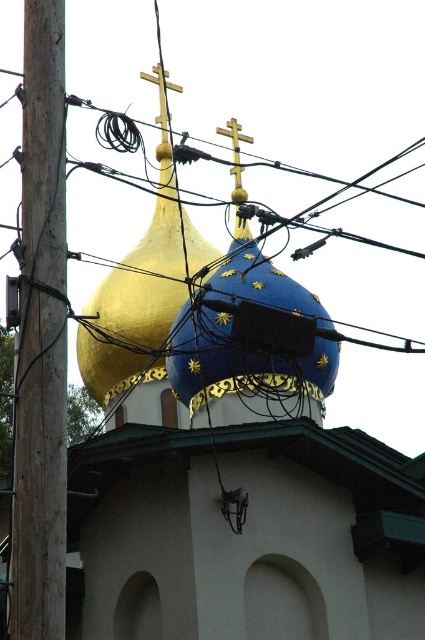
Question: Among these points, which one is farthest from the camera?

Choices:
 (A) (246, 285)
 (B) (248, 138)
 (C) (158, 122)

Answer: (C)

Question: Which point is farther to the camera?

Choices:
 (A) wooden utility pole at left
 (B) gold metallic cross at upper center
 (C) gold metallic dome at upper center

Answer: (B)

Question: Observing the image, what is the correct spatial positioning of gold polished metal cross at center in reference to gold metallic cross at upper center?

Choices:
 (A) right
 (B) left

Answer: (A)

Question: Does blue glossy dome at center have a smaller size compared to gold polished metal cross at center?

Choices:
 (A) yes
 (B) no

Answer: (B)

Question: Among these objects, which one is farthest from the camera?

Choices:
 (A) blue glossy dome at center
 (B) gold metallic dome at upper center

Answer: (B)

Question: Is the position of wooden utility pole at left less distant than that of gold metallic dome at upper center?

Choices:
 (A) yes
 (B) no

Answer: (A)